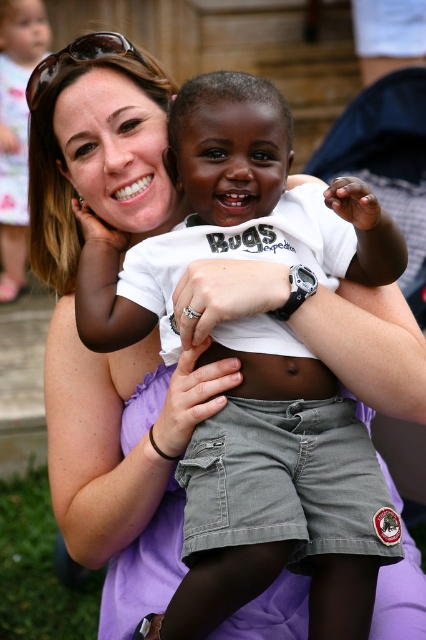
Is the position of smooth white skin at center more distant than that of sunglasses at upper left?

That is False.

Which is above, smooth white skin at center or sunglasses at upper left?

Positioned higher is sunglasses at upper left.

Which is behind, point (232, 396) or point (72, 60)?

The point (72, 60) is behind.

The height and width of the screenshot is (640, 426). I want to click on smooth white skin at center, so point(275,374).

Between gray cotton shorts at center and sunglasses at upper left, which one appears on the right side from the viewer's perspective?

From the viewer's perspective, gray cotton shorts at center appears more on the right side.

Which of these two, gray cotton shorts at center or sunglasses at upper left, stands taller?

gray cotton shorts at center is taller.

Locate an element on the screen. This screenshot has height=640, width=426. gray cotton shorts at center is located at coordinates (287, 483).

Find the location of a particular element. Image resolution: width=426 pixels, height=640 pixels. gray cotton shorts at center is located at coordinates (287, 483).

The image size is (426, 640). Find the location of `gray cotton shorts at center`. gray cotton shorts at center is located at coordinates (287, 483).

The height and width of the screenshot is (640, 426). Identify the location of gray cotton shorts at center. (287, 483).